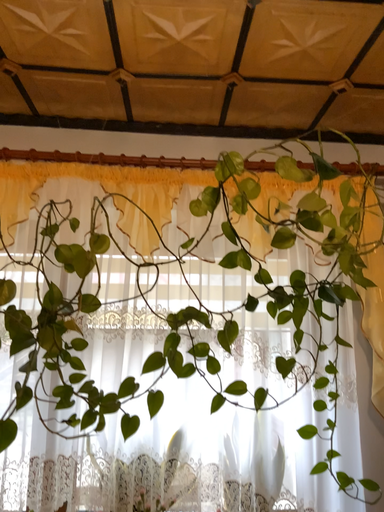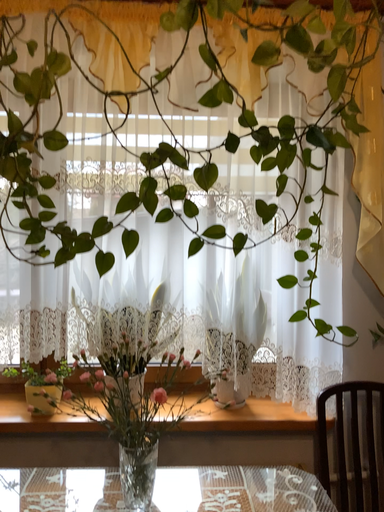
Question: How did the camera likely rotate when shooting the video?

Choices:
 (A) rotated downward
 (B) rotated upward

Answer: (A)